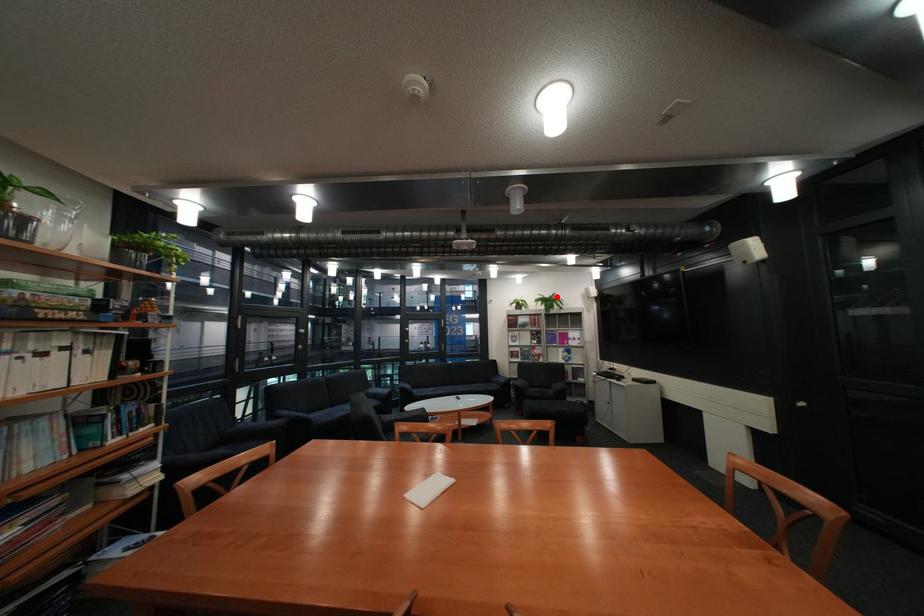
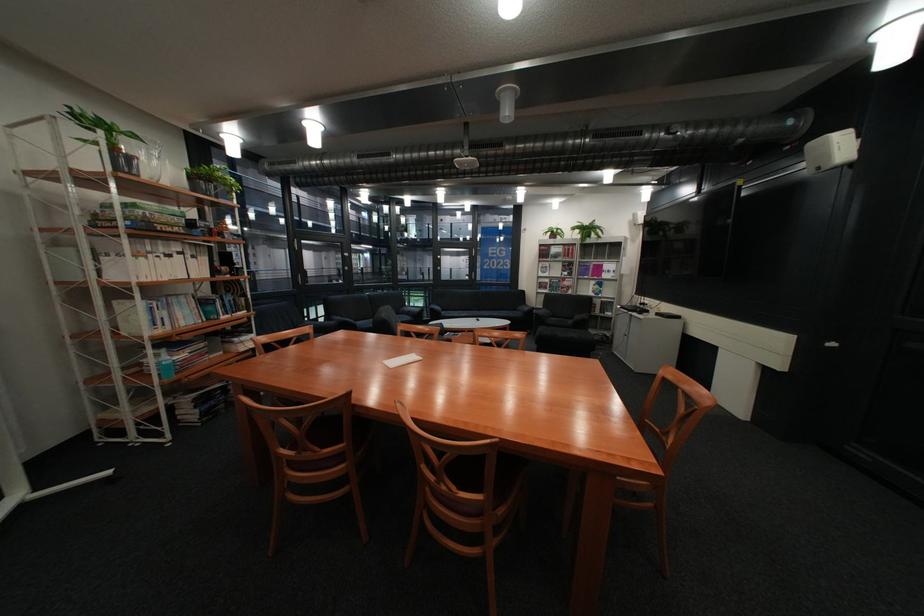
Question: I am providing you with two images of the same scene from different viewpoints. In image1, a red point is highlighted. Considering the same 3D point in image2, which of the following is correct?

Choices:
 (A) It is closer
 (B) It is farther

Answer: (A)